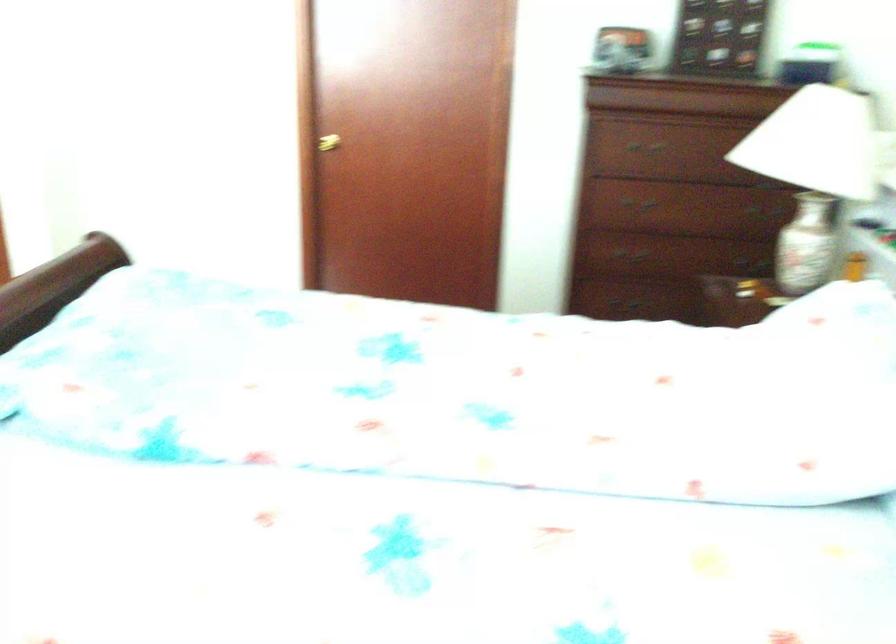
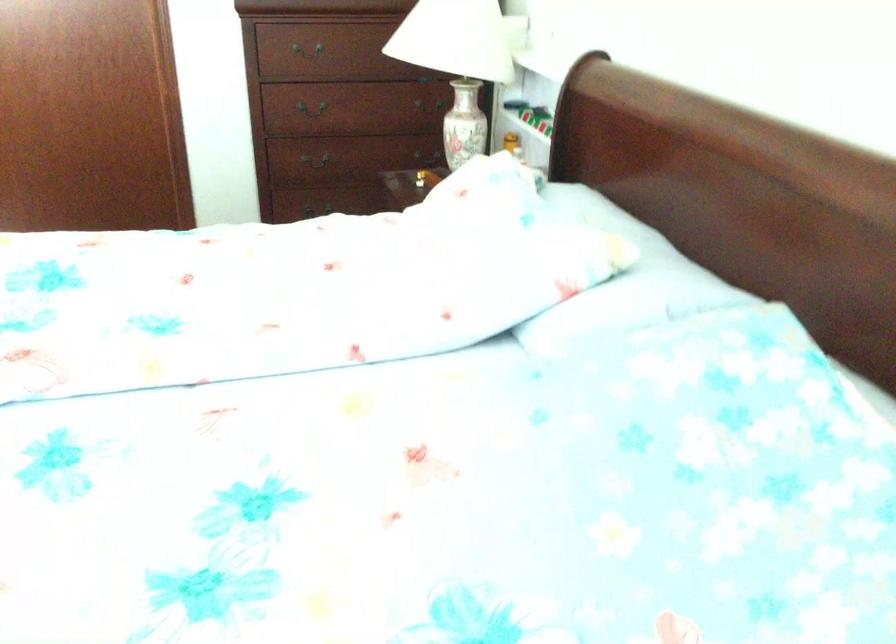
Find the pixel in the second image that matches (634,297) in the first image.

(321, 200)